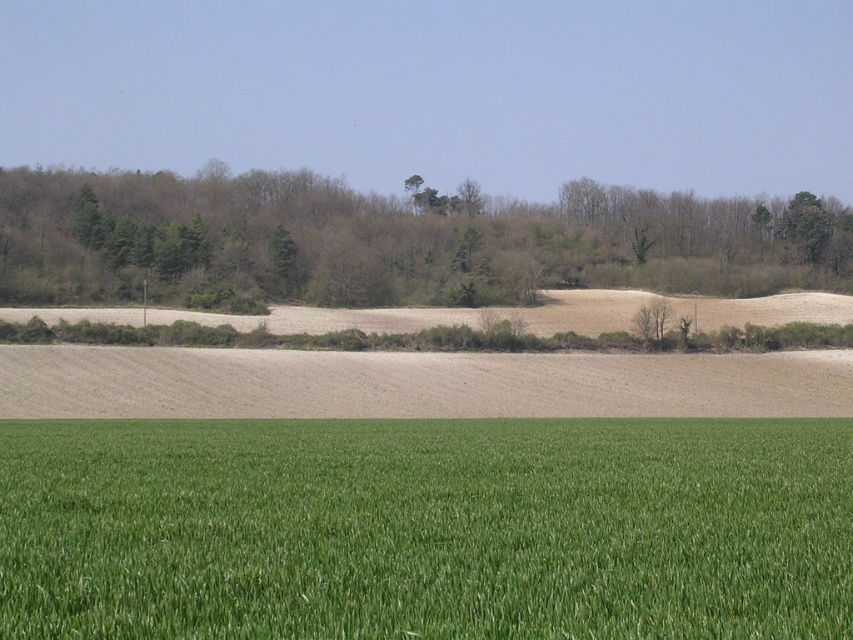
Which of these two, green grass at lower center or green leafy trees at upper center, stands shorter?

With less height is green grass at lower center.

Find the location of a particular element. This screenshot has width=853, height=640. green grass at lower center is located at coordinates (426, 529).

This screenshot has width=853, height=640. Identify the location of green grass at lower center. (426, 529).

Who is higher up, green leafy trees at upper center or brown soil at center?

green leafy trees at upper center

Does point (54, 195) come behind point (38, 381)?

Yes.

Is point (250, 225) farther from viewer compared to point (390, 406)?

Yes.

I want to click on green leafy trees at upper center, so click(x=392, y=241).

Does point (296, 541) come behind point (408, 353)?

No, (296, 541) is in front of (408, 353).

In the scene shown: Is green grass at lower center shorter than brown soil at center?

Yes.

Does point (722, 440) lie in front of point (616, 356)?

That is True.

Image resolution: width=853 pixels, height=640 pixels. Identify the location of green grass at lower center. (426, 529).